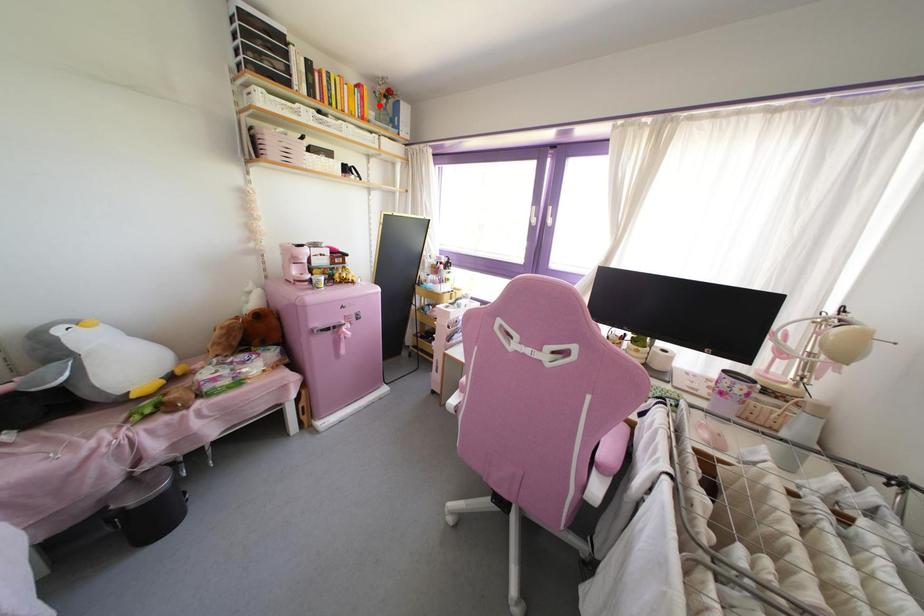
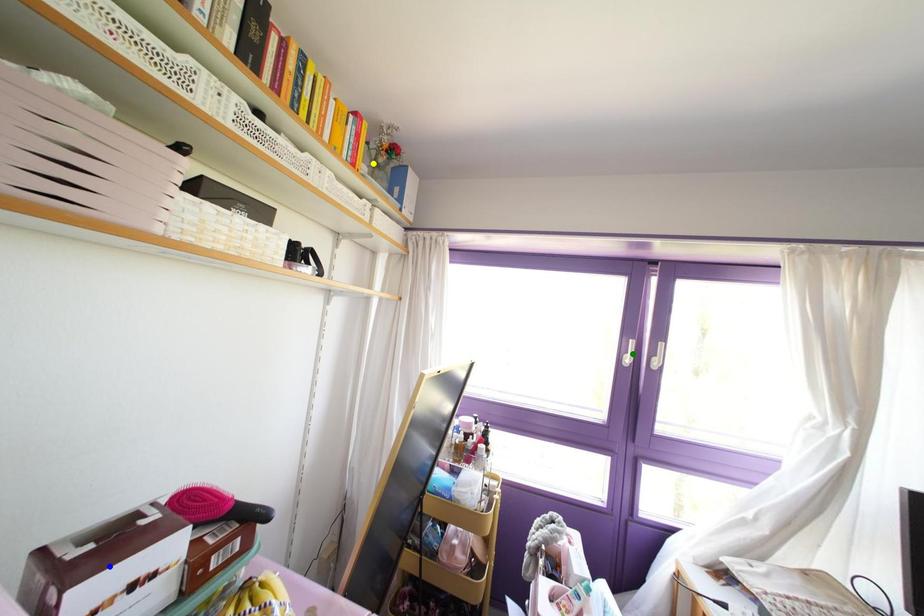
Question: I am providing you with two images of the same scene from different viewpoints. A red point is marked on the first image. You are given multiple points on the second image. Can you choose the point in image 2 that corresponds to the point in image 1?

Choices:
 (A) yellow point
 (B) green point
 (C) blue point

Answer: (A)